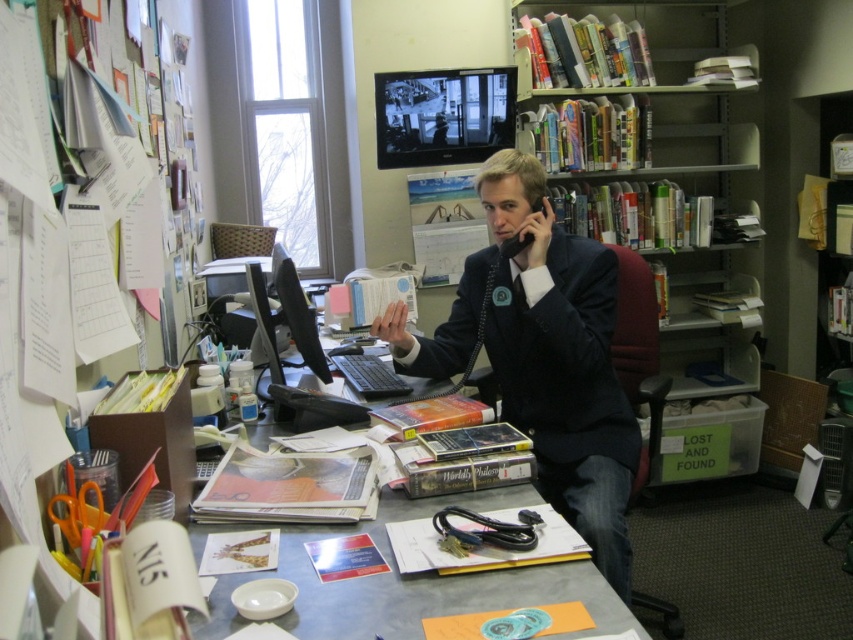
In the scene shown: You are organizing the office and need to place a new item on the desk. Considering the space available on the metallic gray desk at center, will the hardcover books at upper right fit on it without overlapping the edges?

The hardcover books at upper right are wider than the metallic gray desk at center, so placing them there would cause them to overlap the desk edges.

You are an office assistant who needs to place a new document on the desk. The document must be placed exactly at the coordinates given for the hardcover books at upper right. What are the coordinates where you should place the document?

The coordinates for the hardcover books at upper right are at point (663, 220), so you should place the document there.